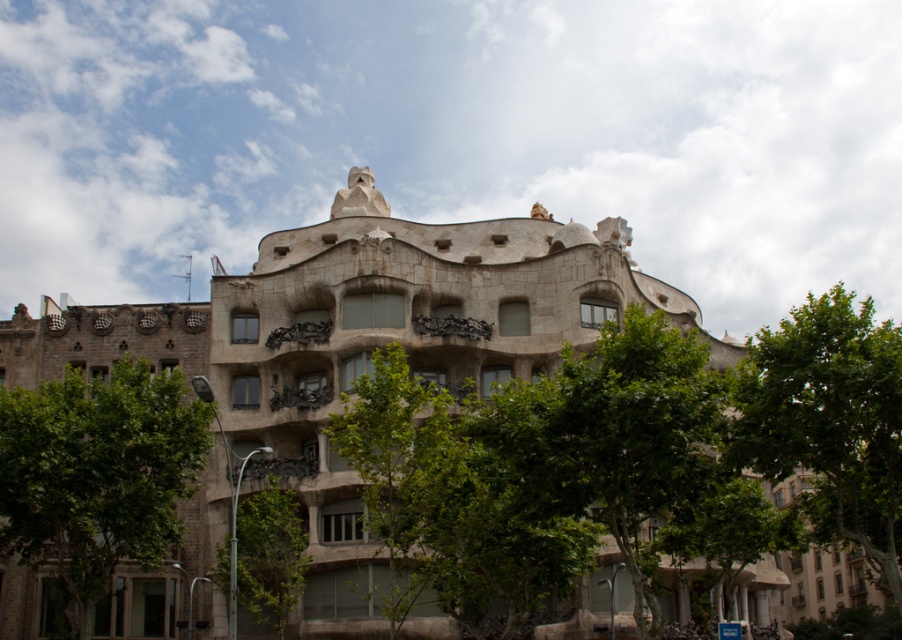
Question: Based on their relative distances, which object is nearer to the green leafy tree at lower left?

Choices:
 (A) green leafy tree at lower center
 (B) green leafy tree at center
 (C) green leafy tree at right

Answer: (A)

Question: Is green leafy tree at right further to the viewer compared to green leafy tree at center?

Choices:
 (A) yes
 (B) no

Answer: (B)

Question: Which of the following is the closest to the observer?

Choices:
 (A) (778, 408)
 (B) (240, 570)
 (C) (133, 460)

Answer: (A)

Question: Can you confirm if green leafy tree at lower left is positioned to the left of green leafy tree at center?

Choices:
 (A) yes
 (B) no

Answer: (A)

Question: Which point is farther to the camera?

Choices:
 (A) (117, 529)
 (B) (226, 547)

Answer: (B)

Question: Does green leafy tree at lower left appear on the right side of green leafy tree at center?

Choices:
 (A) no
 (B) yes

Answer: (A)